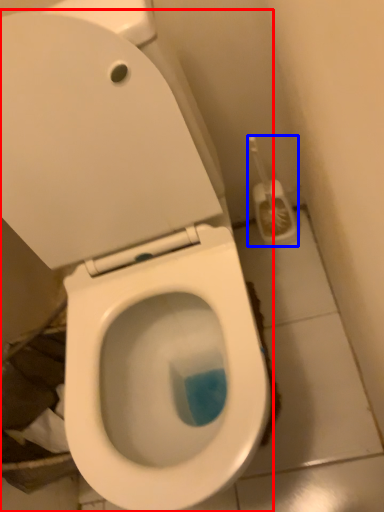
Question: Among these objects, which one is farthest to the camera, toilet (highlighted by a red box) or brush (highlighted by a blue box)?

Choices:
 (A) toilet
 (B) brush

Answer: (B)